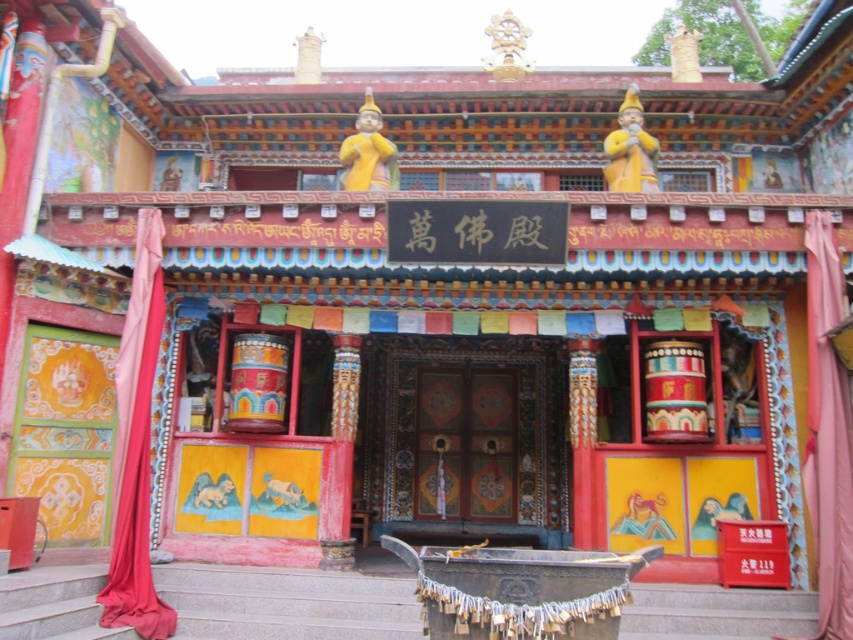
Question: Does wooden stairs at lower center appear over pink fabric curtain at right?

Choices:
 (A) no
 (B) yes

Answer: (A)

Question: Which point is closer to the camera?

Choices:
 (A) painted wood door at center
 (B) wooden stairs at lower center

Answer: (B)

Question: Among these points, which one is nearest to the camera?

Choices:
 (A) click(828, 216)
 (B) click(488, 509)

Answer: (A)

Question: Which point is farther from the camera taking this photo?

Choices:
 (A) (399, 499)
 (B) (821, 620)
 (C) (126, 349)

Answer: (A)

Question: Is painted wood door at center positioned before wooden stairs at lower center?

Choices:
 (A) yes
 (B) no

Answer: (B)

Question: From the image, what is the correct spatial relationship of painted wood door at center in relation to pink fabric curtain at right?

Choices:
 (A) below
 (B) above

Answer: (B)